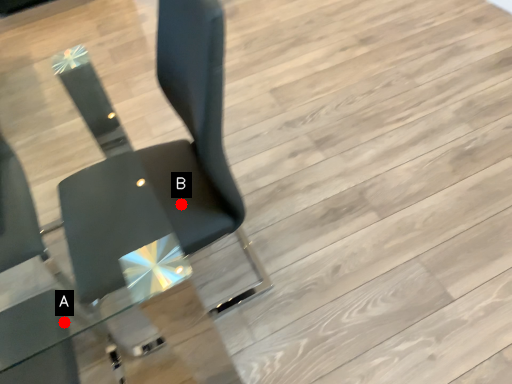
Question: Two points are circled on the image, labeled by A and B beside each circle. Which point is closer to the camera?

Choices:
 (A) A is closer
 (B) B is closer

Answer: (A)